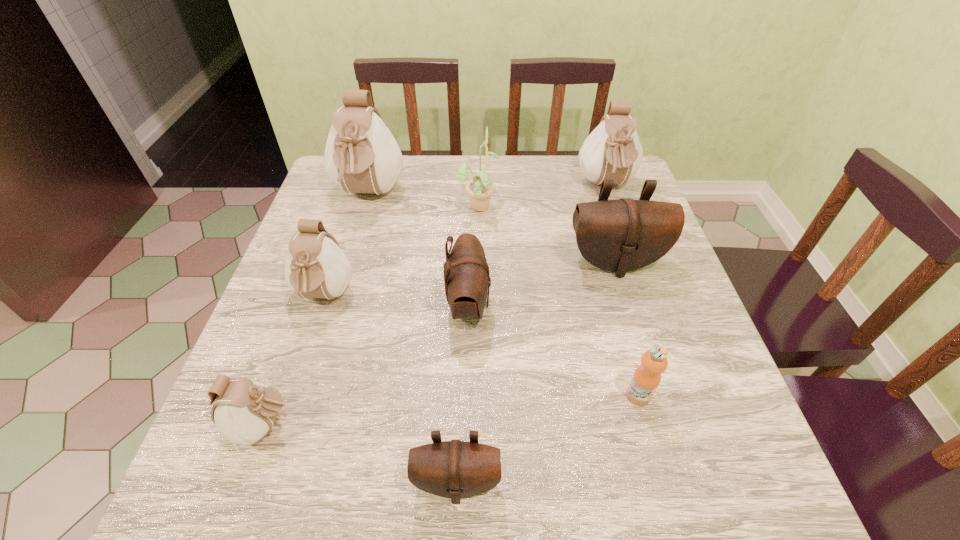
The width and height of the screenshot is (960, 540). I want to click on the nearest brown pouch, so click(455, 469).

Identify the location of vacant space located on the front-facing side of the tallest pouch. (347, 268).

Locate an element on the screen. free space located 0.400m on the front-facing side of the yellow sunflower is located at coordinates (646, 205).

The width and height of the screenshot is (960, 540). Find the location of `blank space located on the front-facing side of the rightmost white pouch`. blank space located on the front-facing side of the rightmost white pouch is located at coordinates (637, 276).

Where is `vacant region located with the flap open on the rightmost brown pouch`? This screenshot has width=960, height=540. vacant region located with the flap open on the rightmost brown pouch is located at coordinates pos(632,318).

Identify the location of free space located on the front-facing side of the second smallest white pouch. (285, 417).

Find the location of a particular element. free space located 0.110m with the flap open on the second biggest brown pouch is located at coordinates (541, 305).

The image size is (960, 540). Find the location of `free space located 0.060m on the front label of the orange juice`. free space located 0.060m on the front label of the orange juice is located at coordinates (650, 440).

Where is `vacant area located 0.130m on the front-facing side of the second nearest pouch`? Image resolution: width=960 pixels, height=540 pixels. vacant area located 0.130m on the front-facing side of the second nearest pouch is located at coordinates (376, 426).

Where is `sunflower that is at the far edge`? The height and width of the screenshot is (540, 960). sunflower that is at the far edge is located at coordinates (480, 188).